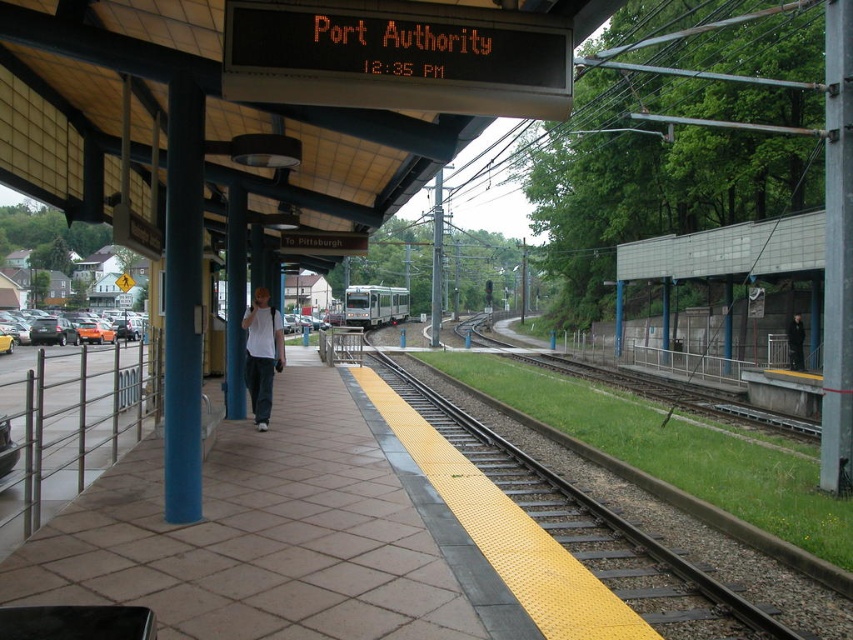
Is point (239, 596) closer to viewer compared to point (405, 374)?

Yes, point (239, 596) is closer to viewer.

Can you confirm if brown tile platform at center is positioned below yellow rubber train track at center?

No.

Does point (114, 472) come closer to viewer compared to point (514, 499)?

Yes.

The width and height of the screenshot is (853, 640). What are the coordinates of `brown tile platform at center` in the screenshot? It's located at (265, 532).

Between brown tile platform at center and silver metallic train at center, which one has more height?

silver metallic train at center is taller.

Does brown tile platform at center have a greater width compared to silver metallic train at center?

Incorrect, brown tile platform at center's width does not surpass silver metallic train at center's.

Locate an element on the screen. brown tile platform at center is located at coordinates (265, 532).

You are a GUI agent. You are given a task and a screenshot of the screen. Output one action in this format:
    pyautogui.click(x=<x>, y=<y>)
    Task: Click on the brown tile platform at center
    
    Given the screenshot: What is the action you would take?
    coord(265,532)

Does silver metallic train at center have a lesser height compared to dark gray jacket at center?

Incorrect, silver metallic train at center's height does not fall short of dark gray jacket at center's.

Who is lower down, silver metallic train at center or dark gray jacket at center?

dark gray jacket at center

Describe the element at coordinates (375, 305) in the screenshot. I see `silver metallic train at center` at that location.

At what (x,y) coordinates should I click in order to perform the action: click on silver metallic train at center. Please return your answer as a coordinate pair (x, y). The height and width of the screenshot is (640, 853). Looking at the image, I should click on (375, 305).